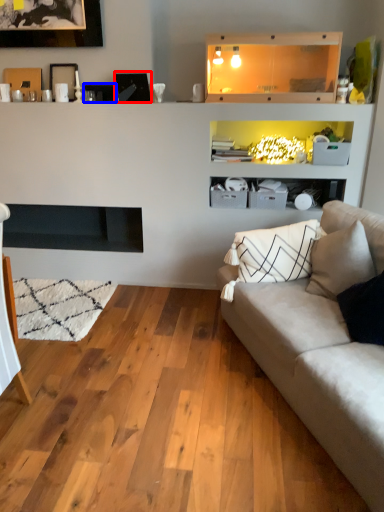
Question: Which object appears closest to the camera in this image, picture frame (highlighted by a red box) or picture frame (highlighted by a blue box)?

Choices:
 (A) picture frame
 (B) picture frame

Answer: (A)